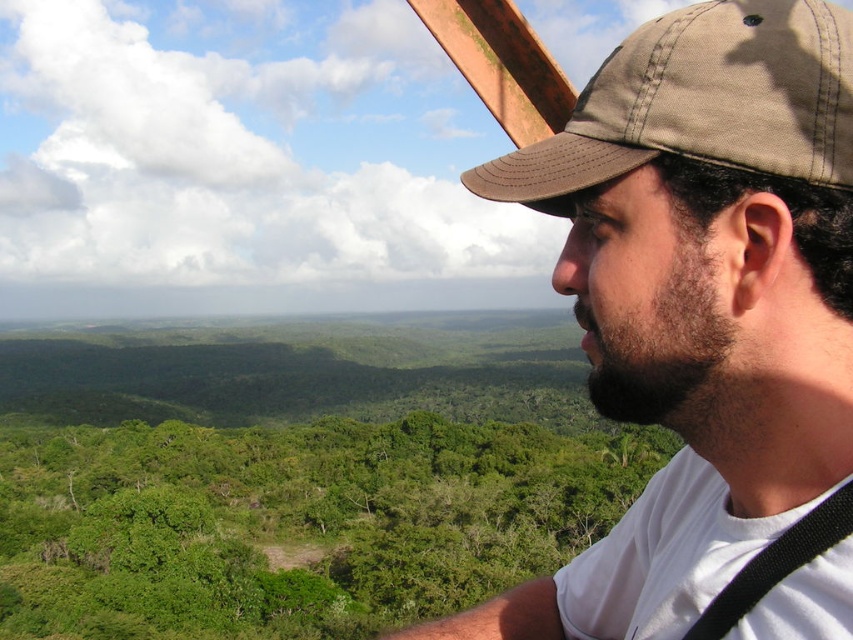
Question: Is green leafy trees at center to the left of brown canvas baseball cap at upper right from the viewer's perspective?

Choices:
 (A) no
 (B) yes

Answer: (B)

Question: Which object is the closest to the brown canvas baseball cap at upper right?

Choices:
 (A) brown fabric cap at upper right
 (B) green leafy trees at center

Answer: (A)

Question: Which point is closer to the camera?

Choices:
 (A) (509, 166)
 (B) (210, 625)
 (C) (741, 460)

Answer: (C)

Question: Which object is farther from the camera taking this photo?

Choices:
 (A) brown canvas baseball cap at upper right
 (B) green leafy trees at center
 (C) brown fabric cap at upper right

Answer: (B)

Question: Can you confirm if green leafy trees at center is thinner than brown canvas baseball cap at upper right?

Choices:
 (A) no
 (B) yes

Answer: (A)

Question: In this image, where is brown fabric cap at upper right located relative to green leafy trees at center?

Choices:
 (A) above
 (B) below

Answer: (A)